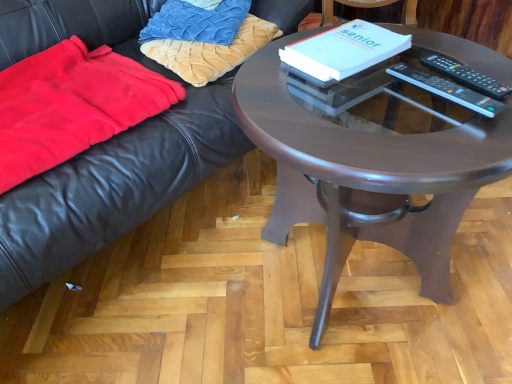
Question: From the image's perspective, is black plastic remote control at right, which is counted as the first remote control, starting from the left, below matte brown table at center?

Choices:
 (A) no
 (B) yes

Answer: (A)

Question: Does black plastic remote control at right, positioned as the 2th remote control in right-to-left order, have a lesser width compared to matte brown table at center?

Choices:
 (A) no
 (B) yes

Answer: (B)

Question: Considering the relative positions of black plastic remote control at right, which is counted as the first remote control, starting from the left, and matte brown table at center in the image provided, is black plastic remote control at right, which is counted as the first remote control, starting from the left, to the left of matte brown table at center from the viewer's perspective?

Choices:
 (A) no
 (B) yes

Answer: (A)

Question: Can you confirm if black plastic remote control at right, positioned as the 2th remote control in right-to-left order, is smaller than matte brown table at center?

Choices:
 (A) no
 (B) yes

Answer: (B)

Question: Is black plastic remote control at right, positioned as the 2th remote control in right-to-left order, taller than matte brown table at center?

Choices:
 (A) no
 (B) yes

Answer: (A)

Question: Does black plastic remote control at right, positioned as the 2th remote control in right-to-left order, turn towards matte brown table at center?

Choices:
 (A) yes
 (B) no

Answer: (A)

Question: Are velvet gold pillow at upper left, positioned as the first pillow in bottom-to-top order, and white paper at center located far from each other?

Choices:
 (A) yes
 (B) no

Answer: (B)

Question: From the image's perspective, is velvet gold pillow at upper left, which is the 2th pillow in top-to-bottom order, on white paper at center?

Choices:
 (A) yes
 (B) no

Answer: (A)

Question: From the image's perspective, is velvet gold pillow at upper left, which is the 2th pillow in top-to-bottom order, below white paper at center?

Choices:
 (A) no
 (B) yes

Answer: (A)

Question: Is velvet gold pillow at upper left, which is the 2th pillow in top-to-bottom order, to the left of white paper at center from the viewer's perspective?

Choices:
 (A) no
 (B) yes

Answer: (B)

Question: Can you confirm if velvet gold pillow at upper left, positioned as the first pillow in bottom-to-top order, is wider than white paper at center?

Choices:
 (A) yes
 (B) no

Answer: (A)

Question: Is velvet gold pillow at upper left, positioned as the first pillow in bottom-to-top order, outside of white paper at center?

Choices:
 (A) yes
 (B) no

Answer: (A)

Question: Does black plastic remote control at upper right, placed as the 1th remote control when sorted from right to left, turn towards velvet gold pillow at upper left, positioned as the first pillow in bottom-to-top order?

Choices:
 (A) yes
 (B) no

Answer: (B)